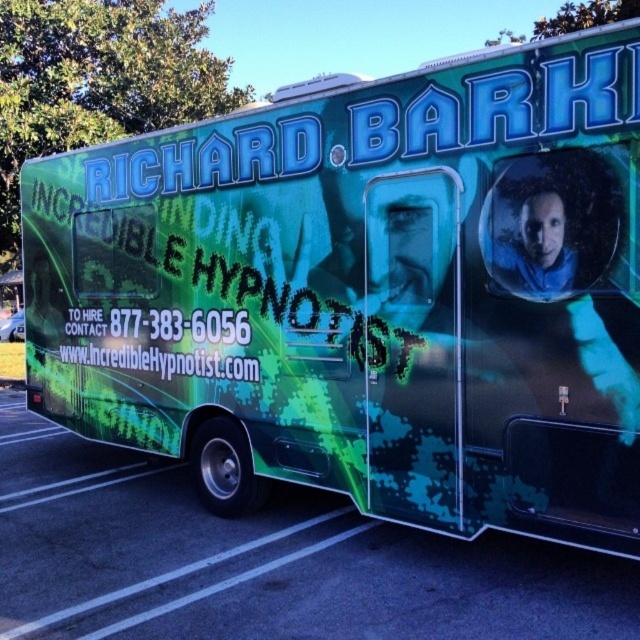
Question: Is green camouflage truck at lower left thinner than white text at center?

Choices:
 (A) yes
 (B) no

Answer: (A)

Question: Among these points, which one is farthest from the camera?

Choices:
 (A) (353, 593)
 (B) (147, 326)

Answer: (B)

Question: Can you confirm if green camouflage truck at lower left is thinner than white text at center?

Choices:
 (A) yes
 (B) no

Answer: (A)

Question: Which of the following is the farthest from the observer?

Choices:
 (A) green camouflage truck at lower left
 (B) white text at center

Answer: (B)

Question: Is green camouflage truck at lower left to the left of white text at center from the viewer's perspective?

Choices:
 (A) no
 (B) yes

Answer: (A)